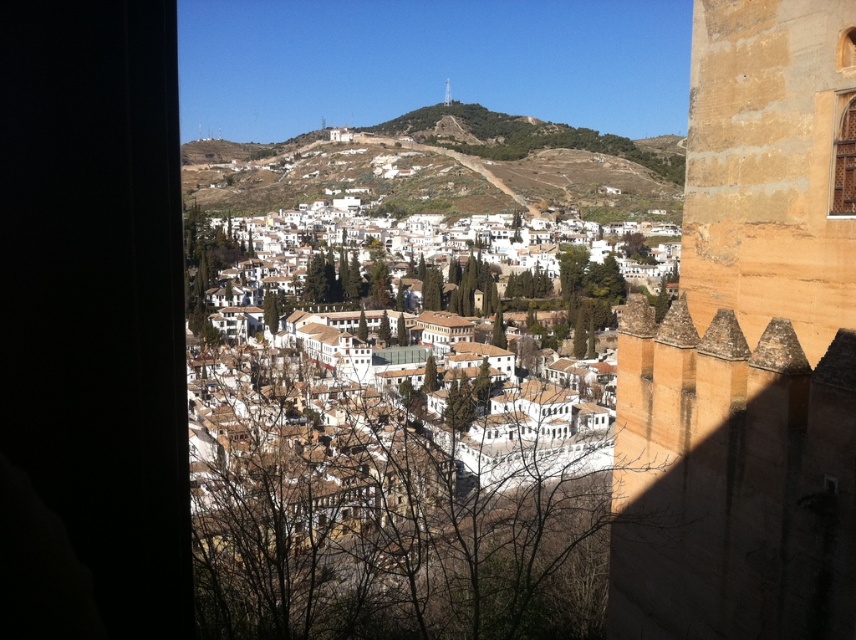
Measure the distance between brown earthy hillside at center and camera.

The distance of brown earthy hillside at center from camera is 293.34 meters.

From the picture: Can you confirm if brown earthy hillside at center is positioned below white matte buildings at center?

No, brown earthy hillside at center is not below white matte buildings at center.

Is point (474, 108) behind point (629, 378)?

That is True.

This screenshot has width=856, height=640. I want to click on brown earthy hillside at center, so click(x=444, y=168).

Does point (307, 147) come in front of point (841, 134)?

No.

Can you confirm if brown earthy hillside at center is positioned below brown wooden window at upper right?

Actually, brown earthy hillside at center is above brown wooden window at upper right.

Is point (456, 202) closer to camera compared to point (843, 216)?

No, (456, 202) is behind (843, 216).

Where is `brown earthy hillside at center`? The image size is (856, 640). brown earthy hillside at center is located at coordinates (444, 168).

Between point (513, 438) and point (837, 168), which one is positioned behind?

The point (513, 438) is behind.

Where is `white matte buildings at center`? white matte buildings at center is located at coordinates (568, 422).

Which is in front, point (494, 400) or point (843, 170)?

Point (843, 170) is in front.

At what (x,y) coordinates should I click in order to perform the action: click on white matte buildings at center. Please return your answer as a coordinate pair (x, y). The image size is (856, 640). Looking at the image, I should click on (568, 422).